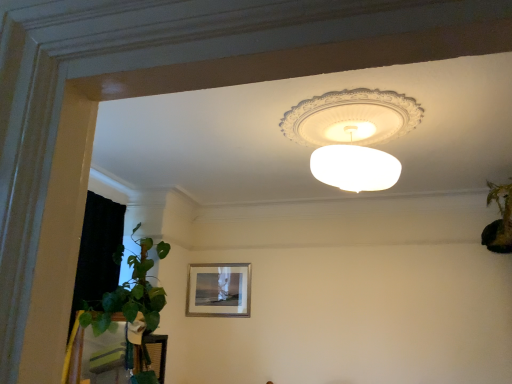
Question: From a real-world perspective, relative to white frosted glass lampshade at upper center, is green leafy plant at right vertically above or below?

Choices:
 (A) below
 (B) above

Answer: (A)

Question: Looking at their shapes, would you say green leafy plant at right is wider or thinner than white frosted glass lampshade at upper center?

Choices:
 (A) wide
 (B) thin

Answer: (B)

Question: Which of these objects is positioned farthest from the matte silver picture frame at center?

Choices:
 (A) green leafy plant at right
 (B) white frosted glass lampshade at upper center

Answer: (A)

Question: Estimate the real-world distances between objects in this image. Which object is closer to the white frosted glass lampshade at upper center?

Choices:
 (A) green leafy plant at right
 (B) matte silver picture frame at center

Answer: (A)